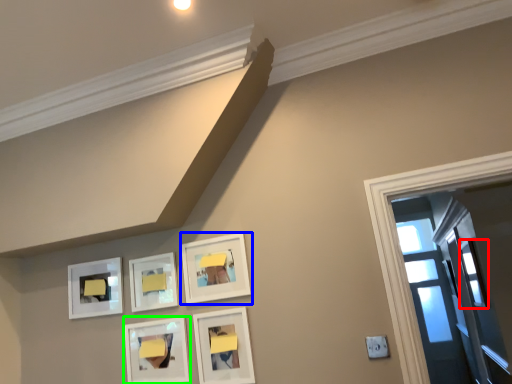
Question: Based on their relative distances, which object is nearer to window (highlighted by a red box)? Choose from picture frame (highlighted by a blue box) and picture frame (highlighted by a green box).

Choices:
 (A) picture frame
 (B) picture frame

Answer: (A)